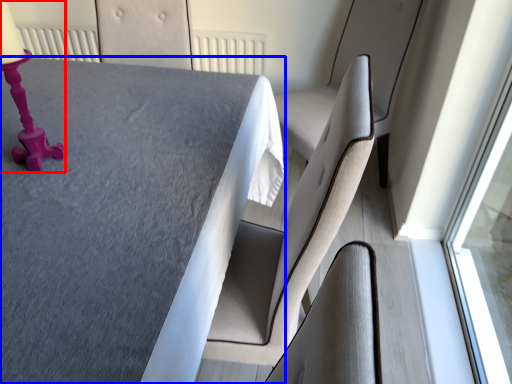
Question: Among these objects, which one is nearest to the camera, table lamp (highlighted by a red box) or table (highlighted by a blue box)?

Choices:
 (A) table lamp
 (B) table

Answer: (B)